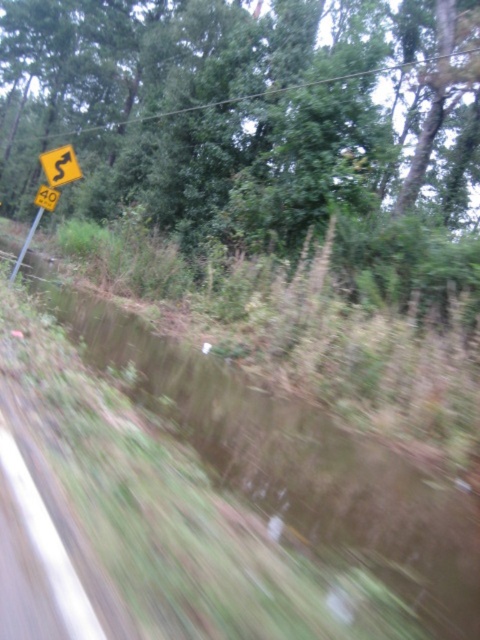
You are driving a car and see the green leafy tree at upper left in the distance. If your car is 5 meters long, can you safely stop before hitting the tree if you need to?

The green leafy tree at upper left is 10.60 meters away from the camera. Since the car is 5 meters long, you have enough distance to safely stop before reaching the tree.